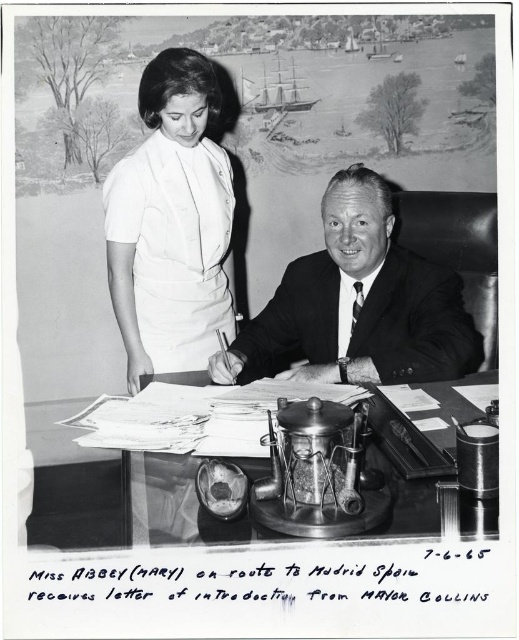
You are an assistant who needs to determine the spatial relationship between the smooth black suit at center and the metallic desk at center. Which object is positioned higher relative to the other?

The smooth black suit at center is above the metallic desk at center, so it is positioned higher.

You are an interior designer assessing the layout of this office space. The white fabric dress at upper left and the metallic desk at center are both in the room. Which object is taller?

The white fabric dress at upper left is taller than the metallic desk at center.

You are a photographer analyzing this black and white image. You notice the white fabric dress at upper left and the smooth black suit at center. Which object is positioned higher in the image?

The white fabric dress at upper left is positioned higher in the image than the smooth black suit at center.